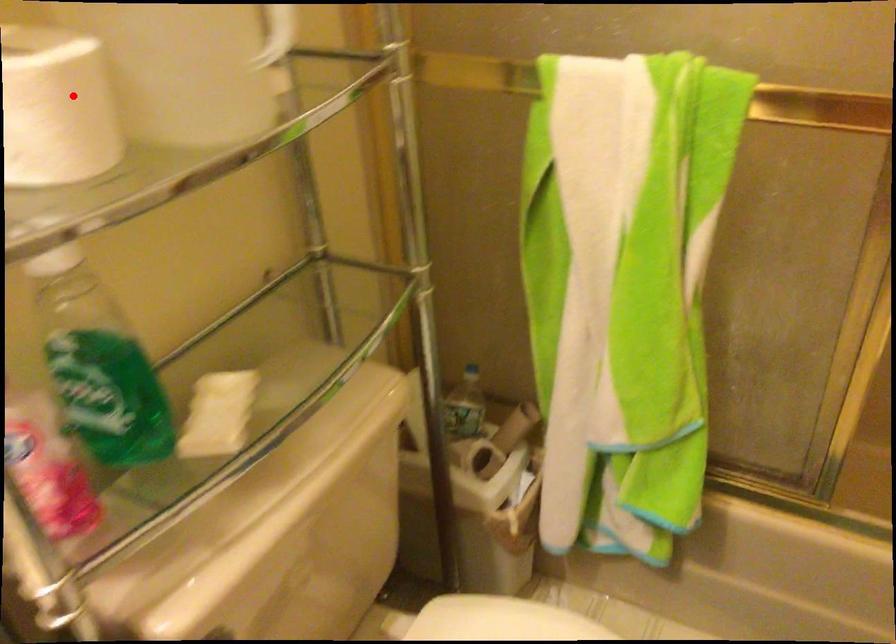
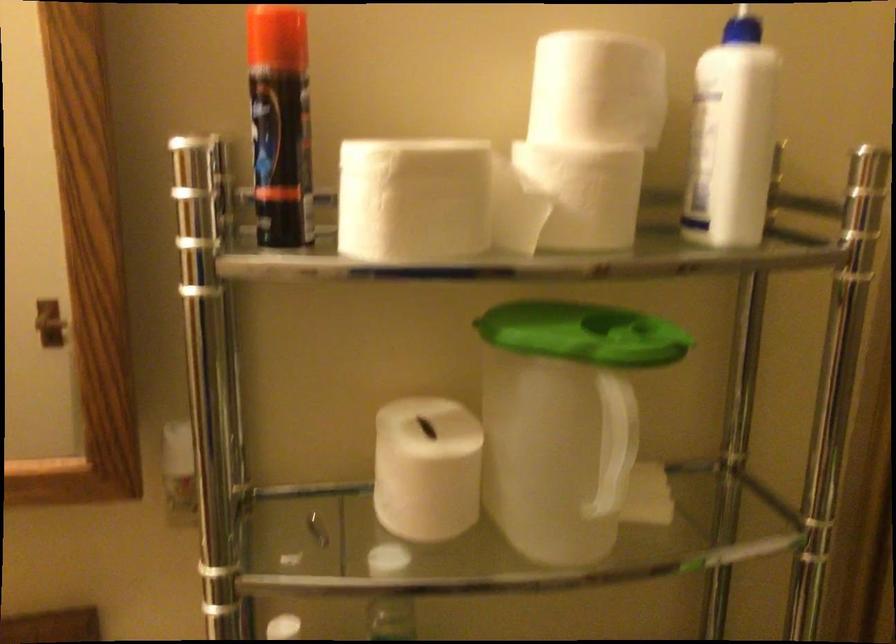
The point at the highlighted location is marked in the first image. Where is the corresponding point in the second image?

(426, 469)